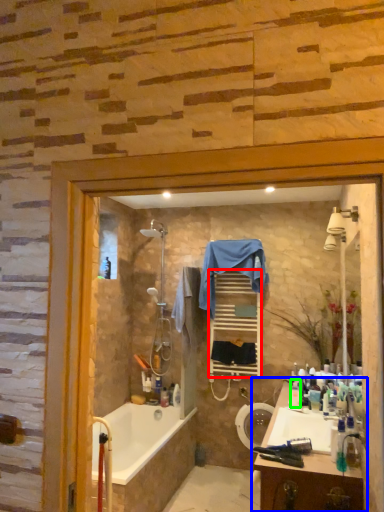
Question: Considering the real-world distances, which object is farthest from shelf (highlighted by a red box)? bathroom cabinet (highlighted by a blue box) or toiletry (highlighted by a green box)?

Choices:
 (A) bathroom cabinet
 (B) toiletry

Answer: (A)